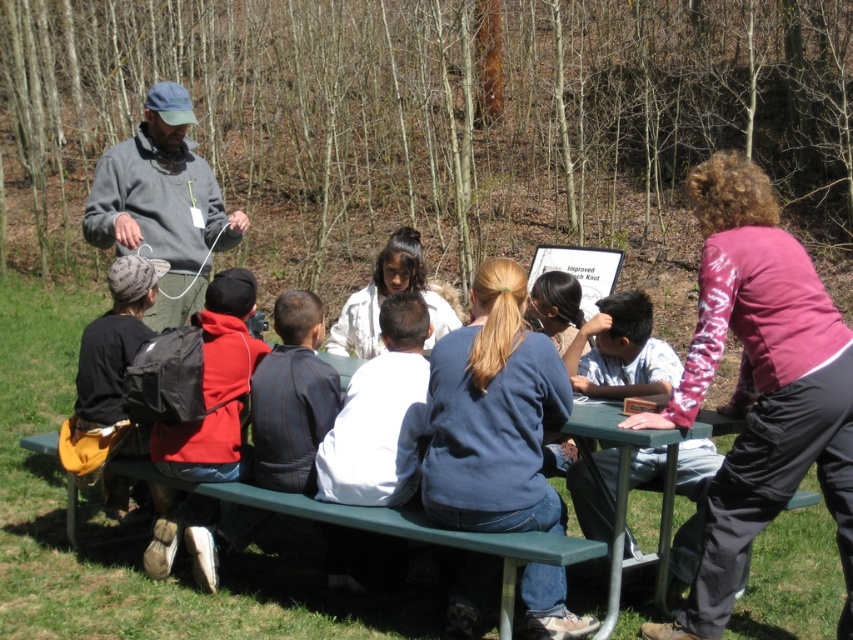
Based on the scene description, where is the gray fleece jacket at upper left located in terms of its 2D coordinates?

The gray fleece jacket at upper left is located at the 2D coordinates point (x=161, y=204).